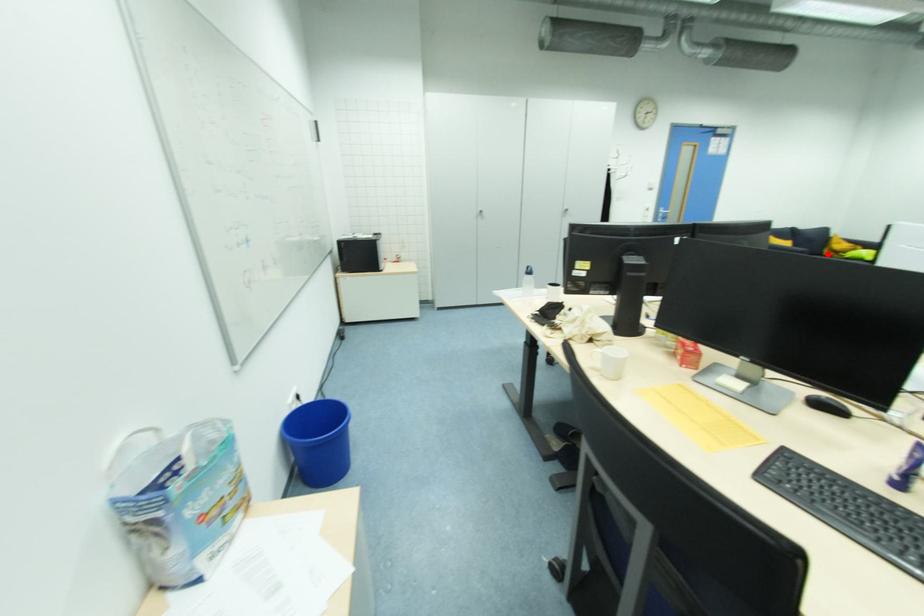
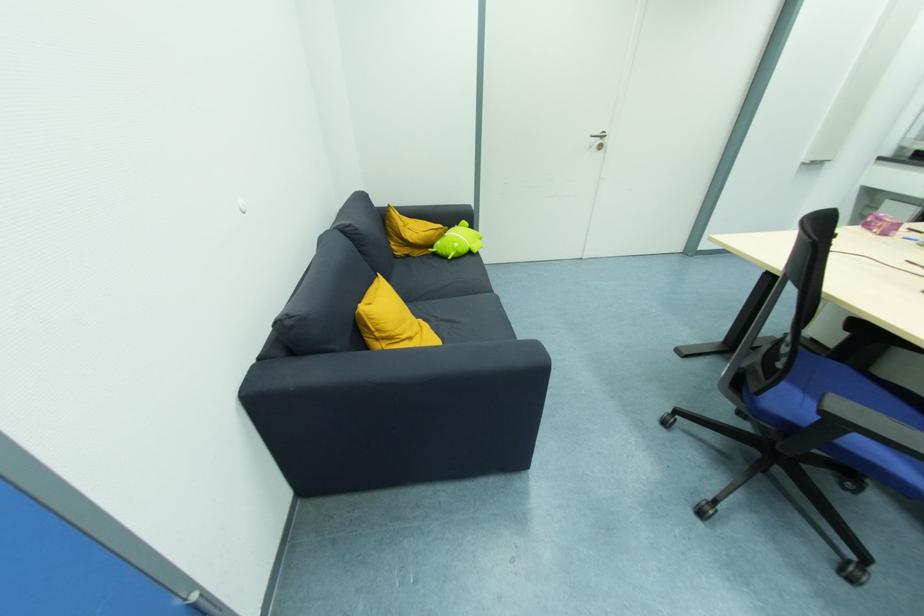
Question: I am providing you with two images of the same scene from different viewpoints. Given a red point in image1, look at the same physical point in image2. Is it:

Choices:
 (A) Closer to the viewpoint
 (B) Farther from the viewpoint

Answer: (A)